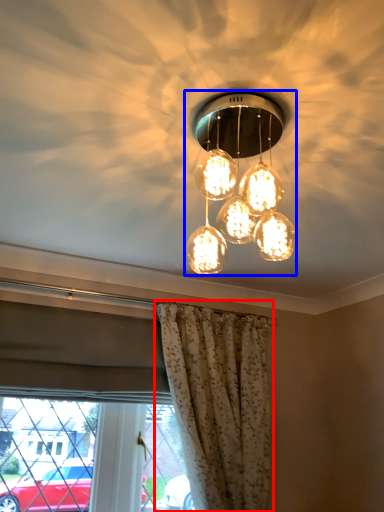
Question: Which object is closer to the camera taking this photo, curtain (highlighted by a red box) or lamp (highlighted by a blue box)?

Choices:
 (A) curtain
 (B) lamp

Answer: (B)